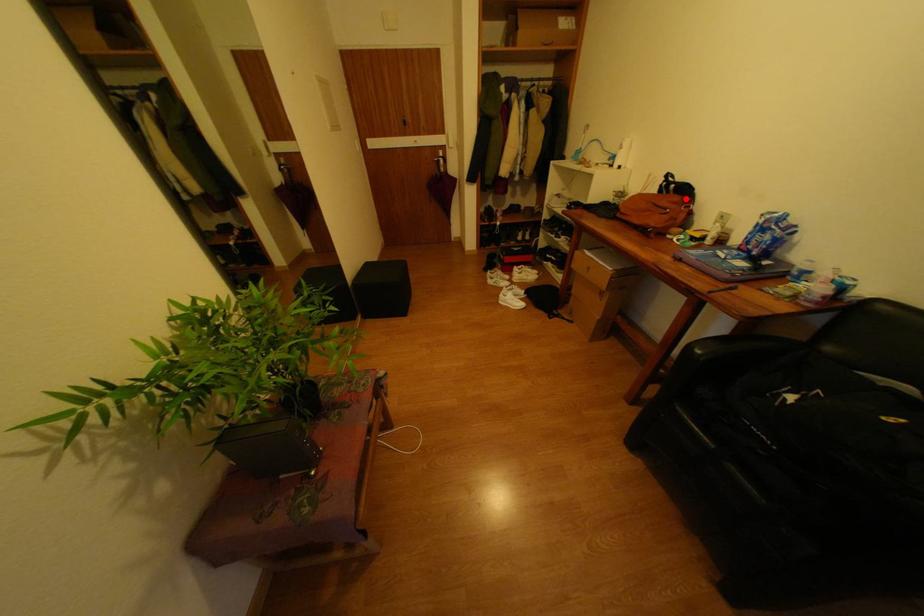
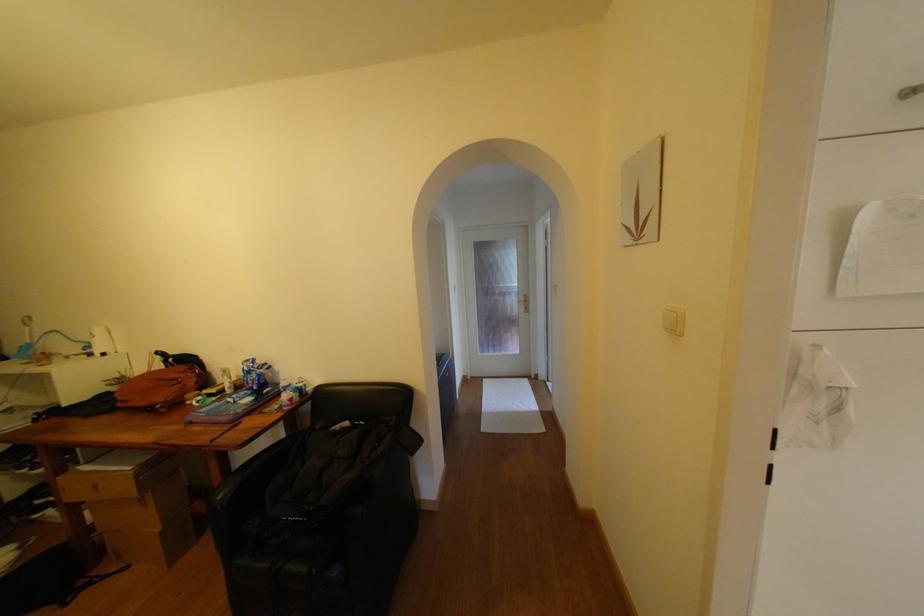
Find the pixel in the second image that matches the highlighted location in the first image.

(190, 369)